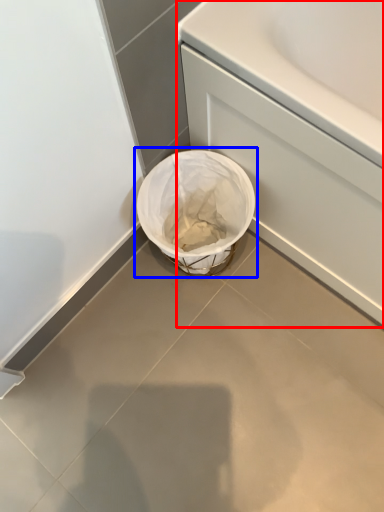
Question: Which of the following is the farthest to the observer, bath (highlighted by a red box) or waste container (highlighted by a blue box)?

Choices:
 (A) bath
 (B) waste container

Answer: (B)